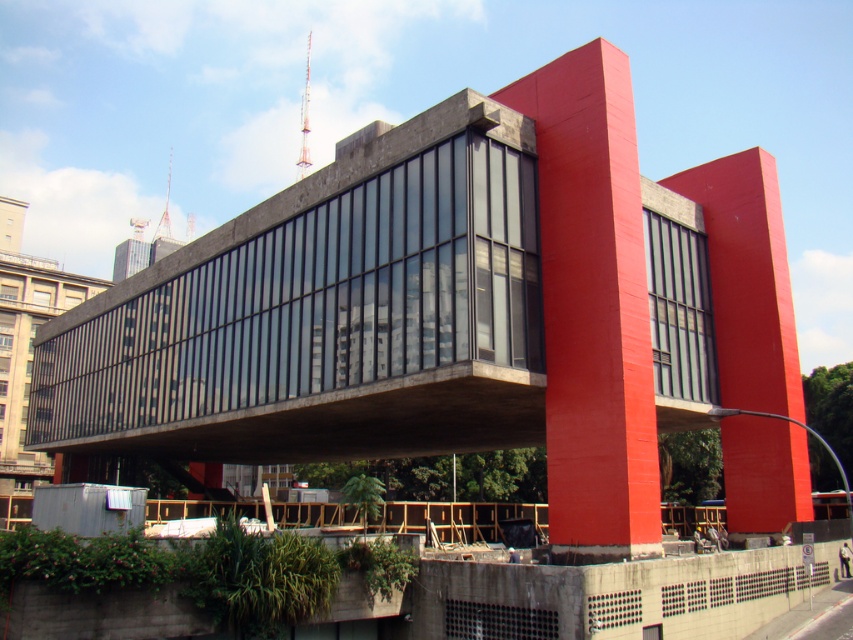
Can you confirm if smooth concrete pillar at center is positioned to the left of matte concrete pillar at right?

Correct, you'll find smooth concrete pillar at center to the left of matte concrete pillar at right.

Which is in front, point (640, 550) or point (775, 492)?

Point (640, 550)

Where is `smooth concrete pillar at center`? This screenshot has height=640, width=853. smooth concrete pillar at center is located at coordinates (593, 307).